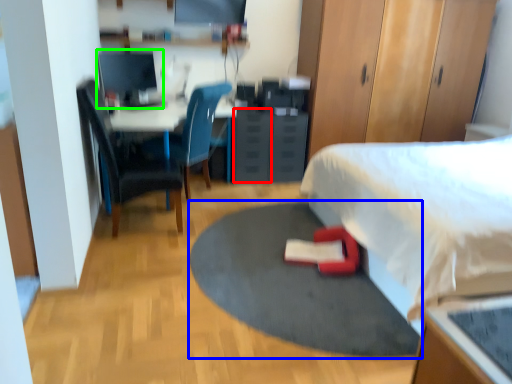
Question: Considering the real-world distances, which object is closest to drawer (highlighted by a red box)? yoga mat (highlighted by a blue box) or computer monitor (highlighted by a green box).

Choices:
 (A) yoga mat
 (B) computer monitor

Answer: (B)